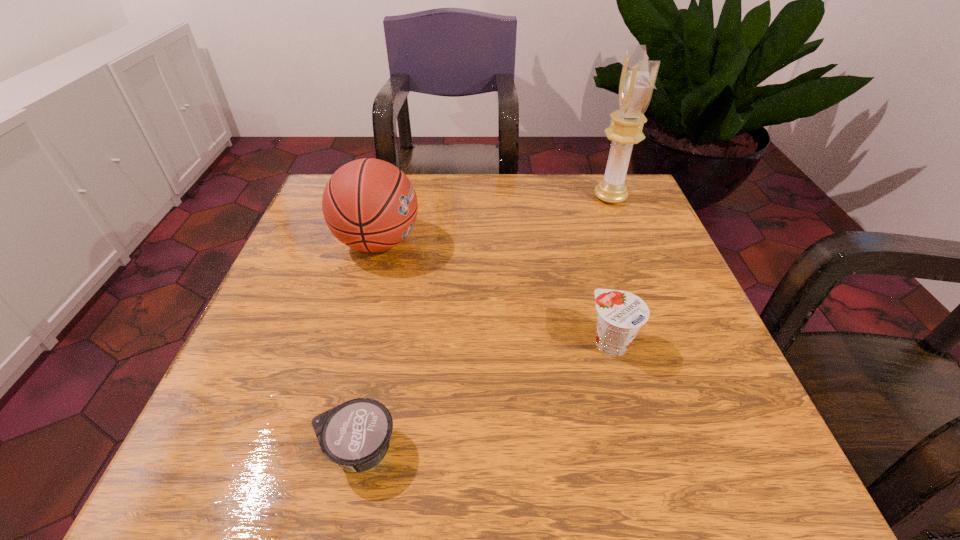
Image resolution: width=960 pixels, height=540 pixels. Find the location of `the farthest object`. the farthest object is located at coordinates (638, 76).

The width and height of the screenshot is (960, 540). What are the coordinates of `the tallest object` in the screenshot? It's located at (638, 76).

Find the location of a particular element. This screenshot has width=960, height=540. the third nearest object is located at coordinates (370, 205).

Image resolution: width=960 pixels, height=540 pixels. Find the location of `the second tallest object`. the second tallest object is located at coordinates (370, 205).

The image size is (960, 540). I want to click on the second shortest object, so click(621, 314).

You are a GUI agent. You are given a task and a screenshot of the screen. Output one action in this format:
    pyautogui.click(x=<x>, y=<y>)
    Task: Click on the second nearest object
    This screenshot has width=960, height=540.
    Given the screenshot: What is the action you would take?
    click(x=621, y=314)

This screenshot has width=960, height=540. Find the location of `the shorter yogurt`. the shorter yogurt is located at coordinates (356, 434).

Find the location of a particular element. the shortest object is located at coordinates (356, 434).

Identify the location of vacant space located 0.070m on the front-facing side of the rightmost object. (566, 197).

Where is `free point located on the front-facing side of the rightmost object`? free point located on the front-facing side of the rightmost object is located at coordinates (574, 197).